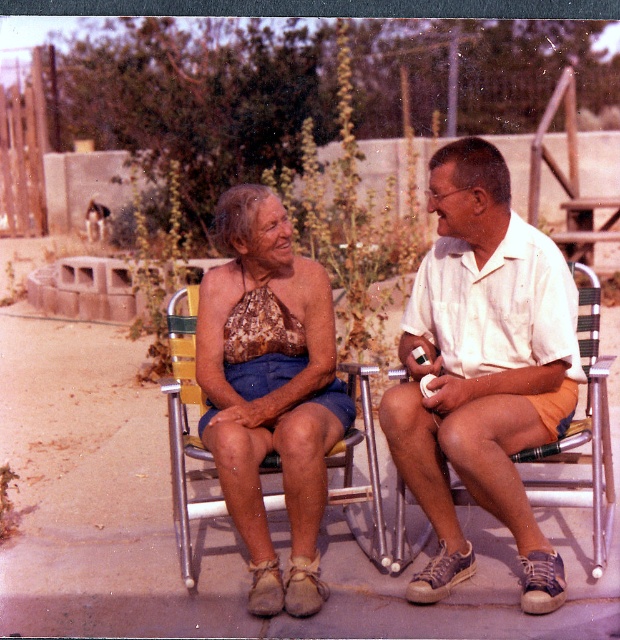
Describe the element at coordinates (482, 369) in the screenshot. I see `matte brown halter top at center` at that location.

Between point (474, 300) and point (541, 465), which one is positioned behind?

Point (541, 465)

Is point (430, 211) farther from viewer compared to point (574, 500)?

No.

This screenshot has height=640, width=620. I want to click on matte brown halter top at center, so click(482, 369).

Can you confirm if brown sequined top at center is positioned below metallic silver beach chair at center?

Actually, brown sequined top at center is above metallic silver beach chair at center.

Does point (232, 400) come closer to viewer compared to point (598, 332)?

Yes.

You are a GUI agent. You are given a task and a screenshot of the screen. Output one action in this format:
    pyautogui.click(x=<x>, y=<y>)
    Task: Click on the brown sequined top at center
    
    Given the screenshot: What is the action you would take?
    pyautogui.click(x=268, y=388)

Does matte brown halter top at center lie in front of brown sequined top at center?

Yes.

Which is in front, point (440, 160) or point (226, 484)?

Point (226, 484) is in front.

Is point (529, 412) closer to viewer compared to point (264, 400)?

Yes, point (529, 412) is in front of point (264, 400).

I want to click on matte brown halter top at center, so click(x=482, y=369).